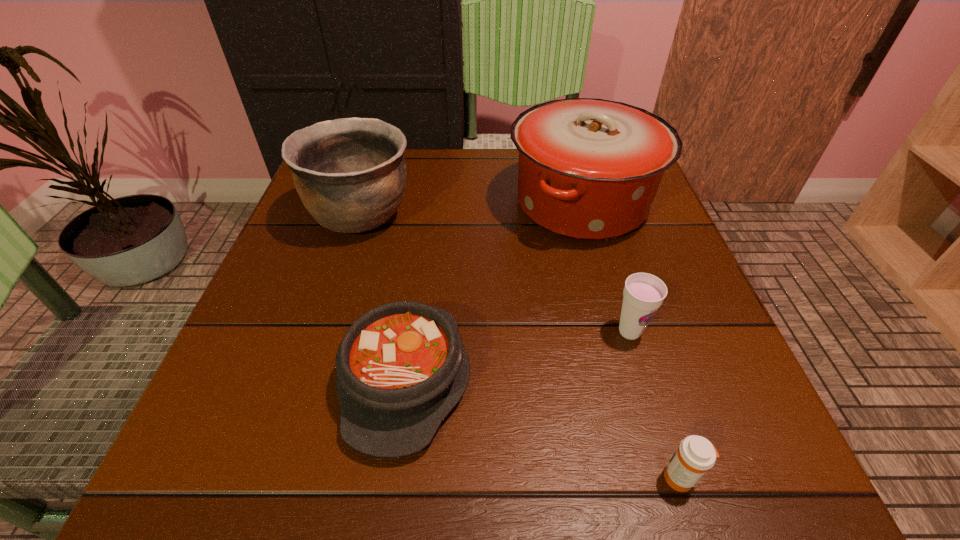
The height and width of the screenshot is (540, 960). I want to click on free space located 0.210m on the back of the left casserole, so click(425, 234).

At what (x,y) coordinates should I click in order to perform the action: click on vacant space located 0.170m on the back of the medicine. Please return your answer as a coordinate pair (x, y). Image resolution: width=960 pixels, height=540 pixels. Looking at the image, I should click on (642, 355).

The width and height of the screenshot is (960, 540). I want to click on casserole at the far edge, so click(589, 169).

At what (x,y) coordinates should I click in order to perform the action: click on pottery that is at the far edge. Please return your answer as a coordinate pair (x, y). The width and height of the screenshot is (960, 540). Looking at the image, I should click on (350, 173).

This screenshot has height=540, width=960. Find the location of `casserole at the near edge`. casserole at the near edge is located at coordinates (401, 367).

Identify the location of medicine present at the near edge. This screenshot has width=960, height=540. (695, 455).

Identify the location of object located at the left edge. (350, 173).

Find the location of a particular element. casserole located in the right edge section of the desktop is located at coordinates (589, 169).

Where is `cup at the right edge`? cup at the right edge is located at coordinates (643, 294).

Identify the location of medicine at the right edge. (695, 455).